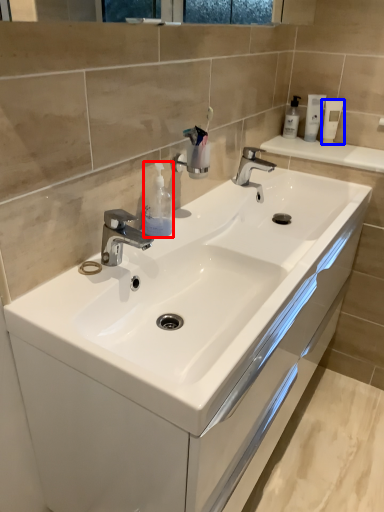
Question: Which point is further to the camera, soap dispenser (highlighted by a red box) or mouthwash (highlighted by a blue box)?

Choices:
 (A) soap dispenser
 (B) mouthwash

Answer: (B)